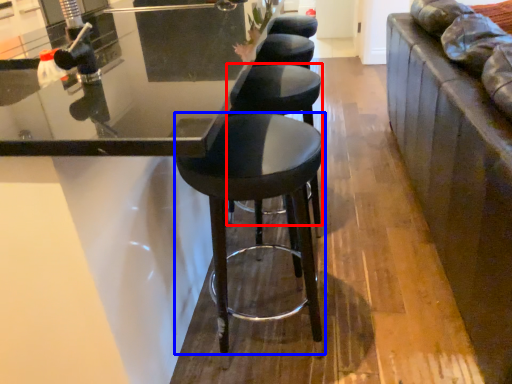
Question: Among these objects, which one is farthest to the camera, stool (highlighted by a red box) or stool (highlighted by a blue box)?

Choices:
 (A) stool
 (B) stool

Answer: (A)